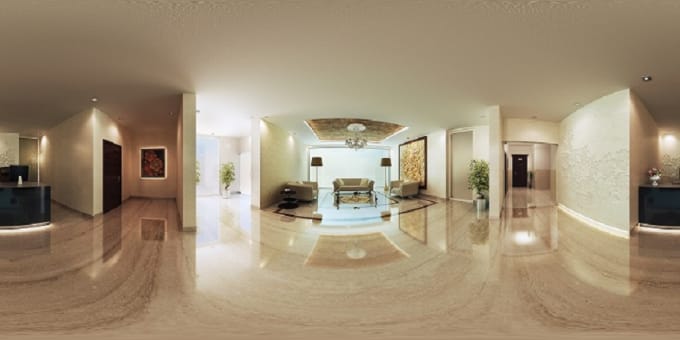
Image resolution: width=680 pixels, height=340 pixels. I want to click on doorway on right side of center room, so click(x=458, y=167).